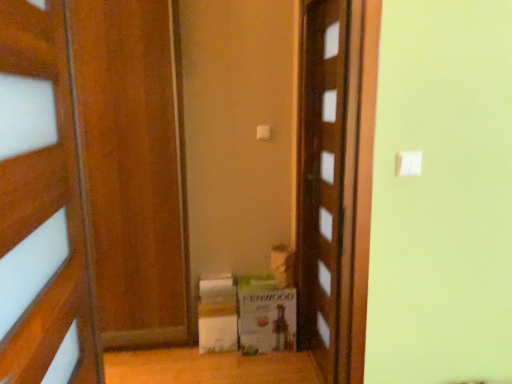
Question: Is wooden door at left, placed as the 1th door when sorted from left to right, to the left or to the right of white cardboard box at lower center, the first cardboard box viewed from the left, in the image?

Choices:
 (A) right
 (B) left

Answer: (B)

Question: Is point (29, 140) closer or farther from the camera than point (202, 309)?

Choices:
 (A) farther
 (B) closer

Answer: (B)

Question: Based on their relative distances, which object is nearer to the green cardboard box at center, which ranks as the 2th cardboard box in left-to-right order?

Choices:
 (A) wooden door at center, the first door positioned from the back
 (B) wooden door at left, placed as the 1th door when sorted from left to right
 (C) white cardboard box at lower center, the first cardboard box viewed from the left

Answer: (C)

Question: Considering the real-world distances, which object is closest to the wooden door at left, which is the second door in right-to-left order?

Choices:
 (A) green cardboard box at center, placed as the 1th cardboard box when sorted from right to left
 (B) white cardboard box at lower center, the first cardboard box viewed from the left
 (C) wooden door at center, acting as the 2th door starting from the front

Answer: (C)